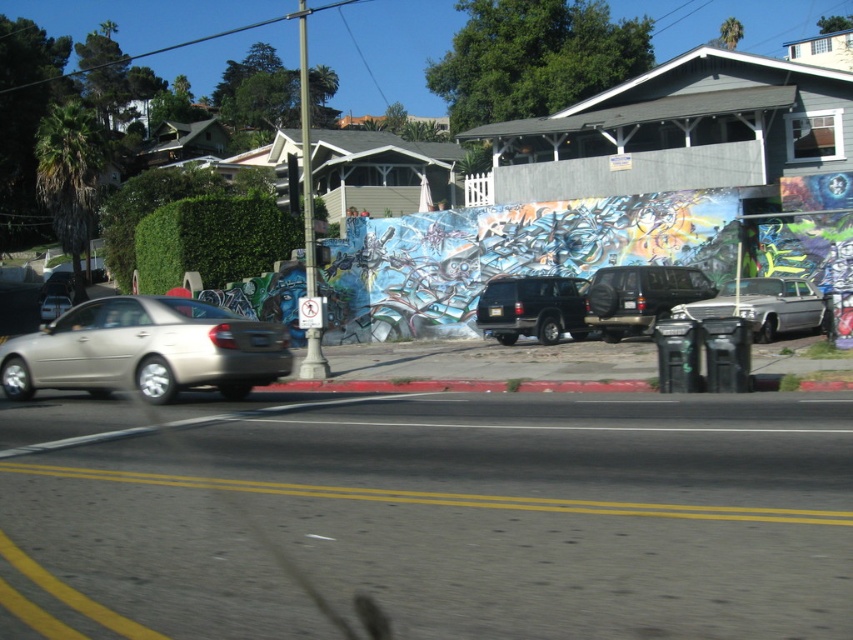
You are a delivery person trying to decide whether to park your 1.8 meters tall delivery box on the street. You see the matte black suv at center and the silver metallic car at right. Which vehicle is taller, and can you safely place your delivery box between them without it touching either?

The matte black suv at center is taller than the silver metallic car at right. Since the delivery box is 1.8 meters tall, and the suv is taller than the car, there should be enough vertical space between them to place the delivery box safely without it touching either vehicle.

You are a delivery driver who needs to load a tall package into your vehicle. You observe the satin black suv at center and the silver metallic car at right in the scene. Which vehicle would be more suitable for carrying the package without the need to tilt it?

The satin black suv at center has a greater height compared to the silver metallic car at right, so it would be more suitable for carrying the tall package without tilting it.